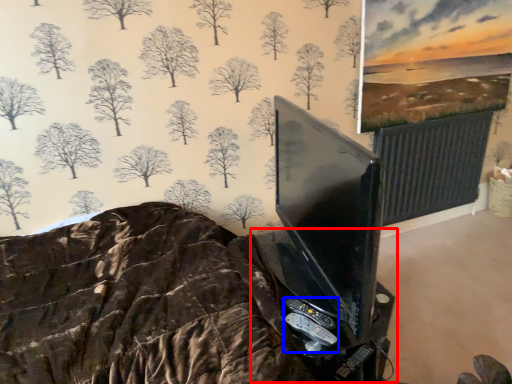
Question: Which of the following is the closest to the observer, table (highlighted by a red box) or game controller (highlighted by a blue box)?

Choices:
 (A) table
 (B) game controller

Answer: (A)